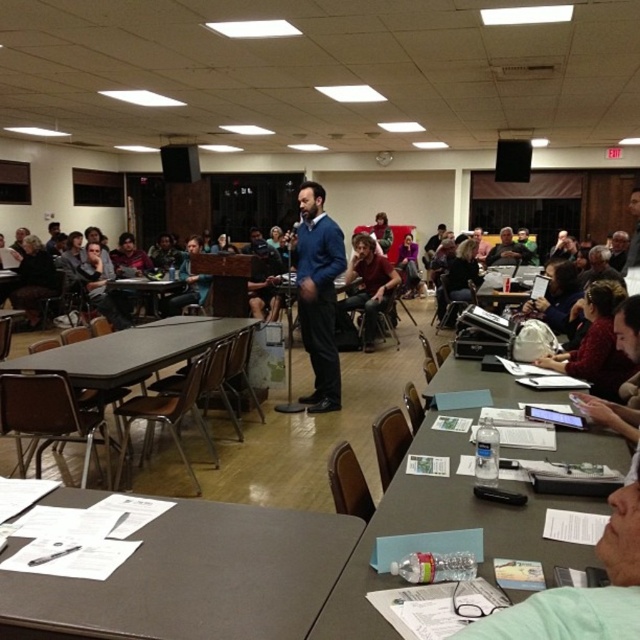
You are organizing a small workshop and need to place a large poster on the wall behind the speaker. The poster requires a clear space equivalent to the size of the matte blue sweater at center. Can the area behind the matte gray table at lower left accommodate this poster?

The matte gray table at lower left occupies less space than the matte blue sweater at center, so the area behind the matte gray table at lower left is not large enough to accommodate the poster requiring space equivalent to the matte blue sweater at center.

You are standing at the origin point of the room. The clear plastic water bottle at lower right is located at coordinates 0.828 on the x axis and 0.692 on the y axis. Which direction should you move to reach it?

The clear plastic water bottle at lower right is located at coordinates 0.828 on the x axis and 0.692 on the y axis. Since the x coordinate is higher than 0.5, you should move to the right. Since the y coordinate is also higher than 0.5, you should move forward. Therefore, you should move diagonally forward and to the right to reach the clear plastic water bottle at lower right.